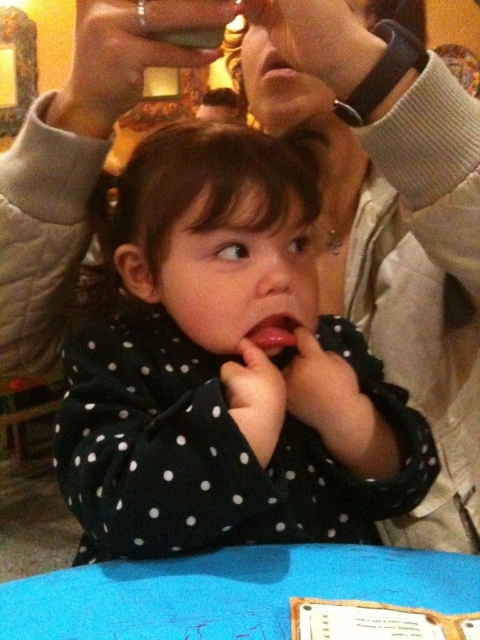
You are a photographer adjusting your camera settings. You notice a point at coordinates (228,369) in the image. What object is located at this point?

The point at coordinates (228,369) marks the location of the black dotted shirt at center.

Looking at this image, you are a waiter in a restaurant and need to place a new order on the table. The order includes a large plate that requires more space than the current items on the table. Which object on the table should you remove to make space, the blue fabric table at lower center or the matte plastic cup at upper center?

You should remove the matte plastic cup at upper center because the blue fabric table at lower center occupies less space, meaning the cup takes up more room and can be moved to free up space for the large plate.